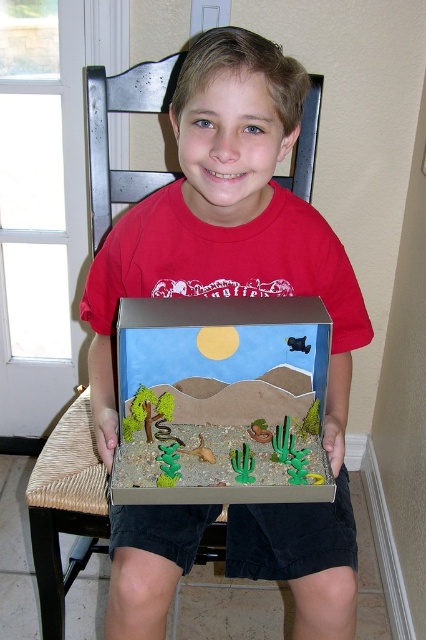
Question: Where is matte cardboard box at center located in relation to cardboard diorama at center in the image?

Choices:
 (A) left
 (B) right

Answer: (A)

Question: Does matte cardboard box at center have a lesser width compared to cardboard diorama at center?

Choices:
 (A) no
 (B) yes

Answer: (A)

Question: Which object is farther from the camera taking this photo?

Choices:
 (A) cardboard diorama at center
 (B) matte cardboard box at center

Answer: (A)

Question: Does matte cardboard box at center have a larger size compared to cardboard diorama at center?

Choices:
 (A) no
 (B) yes

Answer: (B)